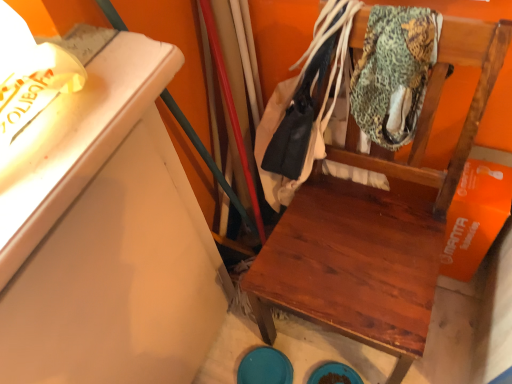
What do you see at coordinates (268, 142) in the screenshot?
I see `leather jacket at center` at bounding box center [268, 142].

This screenshot has width=512, height=384. What do you see at coordinates (376, 224) in the screenshot?
I see `wooden chair at center` at bounding box center [376, 224].

This screenshot has width=512, height=384. I want to click on leather jacket at center, so click(268, 142).

Can you tell me how much textured green fabric at upper right and leather jacket at center differ in facing direction?

4.44 degrees.

From the image's perspective, is textured green fabric at upper right positioned above or below leather jacket at center?

Clearly, from the image's perspective, textured green fabric at upper right is above leather jacket at center.

Is textured green fabric at upper right positioned with its back to leather jacket at center?

Yes, textured green fabric at upper right is facing away from leather jacket at center.

Considering the sizes of textured green fabric at upper right and leather jacket at center in the image, is textured green fabric at upper right wider or thinner than leather jacket at center?

Considering their sizes, textured green fabric at upper right looks slimmer than leather jacket at center.

Is wooden chair at center wider or thinner than leather jacket at center?

Considering their sizes, wooden chair at center looks broader than leather jacket at center.

Does point (347, 142) lie behind point (272, 120)?

That is False.

From the image's perspective, would you say wooden chair at center is shown under leather jacket at center?

Yes.

Is wooden chair at center with leather jacket at center?

No.

Who is smaller, wooden chair at center or textured green fabric at upper right?

Smaller between the two is textured green fabric at upper right.

From the image's perspective, is wooden chair at center located above textured green fabric at upper right?

No, from the image's perspective, wooden chair at center is not above textured green fabric at upper right.

Which is nearer, (436,219) or (372,133)?

Point (436,219) is positioned farther from the camera compared to point (372,133).

Can you confirm if leather jacket at center is positioned to the right of wooden chair at center?

In fact, leather jacket at center is to the left of wooden chair at center.

Who is bigger, leather jacket at center or wooden chair at center?

wooden chair at center is bigger.

Which is behind, point (291, 198) or point (413, 317)?

The point (291, 198) is more distant.

Where is `laundry lying below the textured green fabric at upper right (from the image's perspective)`? This screenshot has height=384, width=512. laundry lying below the textured green fabric at upper right (from the image's perspective) is located at coordinates (268, 142).

From a real-world perspective, is leather jacket at center positioned under textured green fabric at upper right based on gravity?

Yes, from a real-world perspective, leather jacket at center is beneath textured green fabric at upper right.

From their relative heights in the image, would you say leather jacket at center is taller or shorter than textured green fabric at upper right?

Considering their sizes, leather jacket at center has more height than textured green fabric at upper right.

Considering the sizes of objects textured green fabric at upper right and wooden chair at center in the image provided, who is shorter, textured green fabric at upper right or wooden chair at center?

textured green fabric at upper right.

From a real-world perspective, is textured green fabric at upper right positioned over wooden chair at center based on gravity?

Yes, from a real-world perspective, textured green fabric at upper right is over wooden chair at center

How many degrees apart are the facing directions of textured green fabric at upper right and wooden chair at center?

The facing directions of textured green fabric at upper right and wooden chair at center are 0.667 degrees apart.

Is textured green fabric at upper right with wooden chair at center?

No, textured green fabric at upper right is not next to wooden chair at center.

Where is `clothing behind the leather jacket at center`? The height and width of the screenshot is (384, 512). clothing behind the leather jacket at center is located at coordinates (394, 72).

The image size is (512, 384). I want to click on furniture on the right of the leather jacket at center, so pos(376,224).

From the image, which object appears to be farther from textured green fabric at upper right, wooden chair at center or leather jacket at center?

leather jacket at center is further to textured green fabric at upper right.

Which object lies nearer to the anchor point wooden chair at center, leather jacket at center or textured green fabric at upper right?

textured green fabric at upper right.

From the picture: Which object lies further to the anchor point leather jacket at center, wooden chair at center or textured green fabric at upper right?

wooden chair at center is further to leather jacket at center.

Which object lies further to the anchor point leather jacket at center, textured green fabric at upper right or wooden chair at center?

wooden chair at center is further to leather jacket at center.

Looking at the image, which one is located further to wooden chair at center, textured green fabric at upper right or leather jacket at center?

leather jacket at center is positioned further to the anchor wooden chair at center.

Which object lies nearer to the anchor point textured green fabric at upper right, leather jacket at center or wooden chair at center?

wooden chair at center.

The width and height of the screenshot is (512, 384). Identify the location of laundry between textured green fabric at upper right and wooden chair at center in the up-down direction. (268, 142).